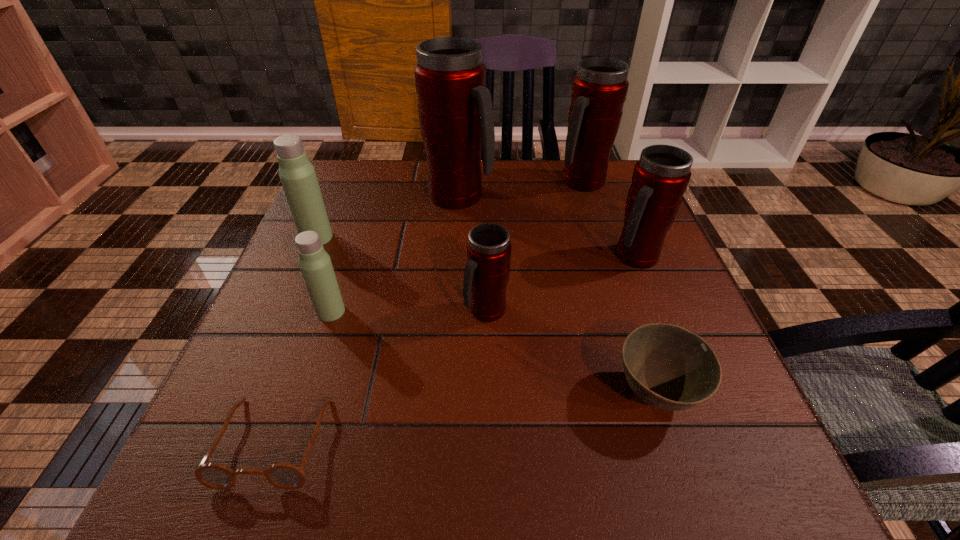
The height and width of the screenshot is (540, 960). Identify the location of the tallest object. (455, 111).

What are the coordinates of `the tallest thermos bottle` in the screenshot? It's located at (455, 111).

Identify the location of the second tallest thermos bottle. The height and width of the screenshot is (540, 960). (599, 90).

Find the location of a particular element. the second biggest red thermos bottle is located at coordinates (599, 90).

You are a GUI agent. You are given a task and a screenshot of the screen. Output one action in this format:
    pyautogui.click(x=<x>, y=<y>)
    Task: Click on the farther light thermos bottle
    The height and width of the screenshot is (540, 960).
    Given the screenshot: What is the action you would take?
    pyautogui.click(x=297, y=175)

The image size is (960, 540). In order to click on the bigger light thermos bottle in this screenshot , I will do `click(297, 175)`.

Locate an element on the screen. This screenshot has width=960, height=540. the second nearest red thermos bottle is located at coordinates (660, 178).

Where is `the nearest red thermos bottle`? The height and width of the screenshot is (540, 960). the nearest red thermos bottle is located at coordinates tap(488, 248).

Identify the location of the smaller light thermos bottle. (315, 264).

Where is `the nearer light thermos bottle`? Image resolution: width=960 pixels, height=540 pixels. the nearer light thermos bottle is located at coordinates (315, 264).